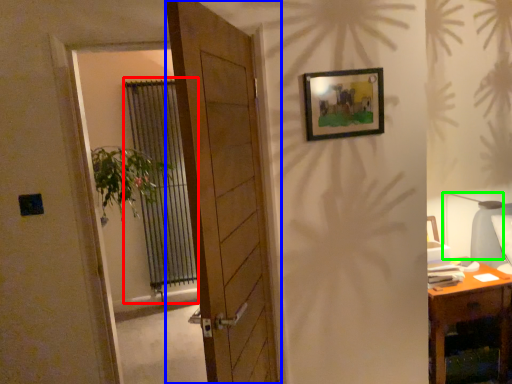
Question: Considering the real-world distances, which object is farthest from curtain (highlighted by a red box)? door (highlighted by a blue box) or table lamp (highlighted by a green box)?

Choices:
 (A) door
 (B) table lamp

Answer: (B)